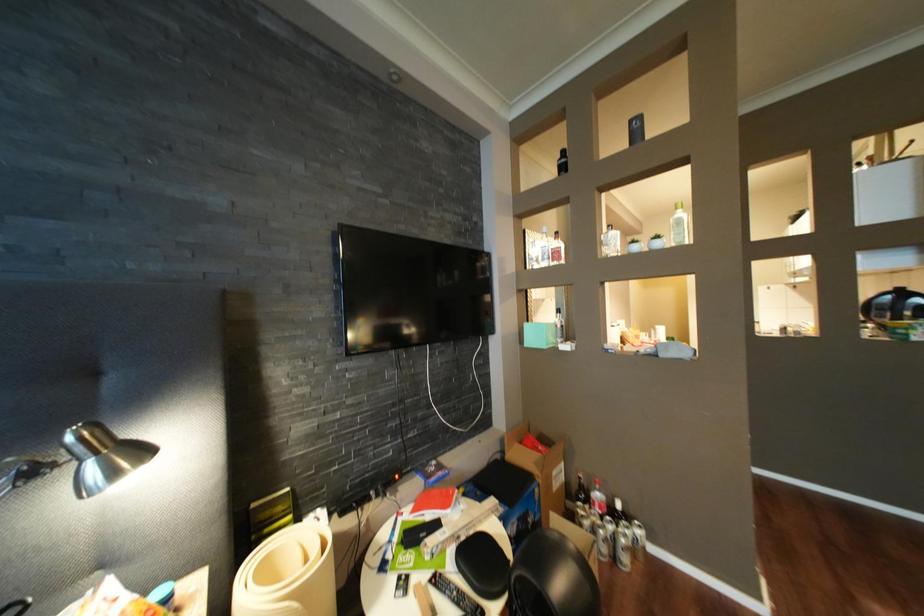
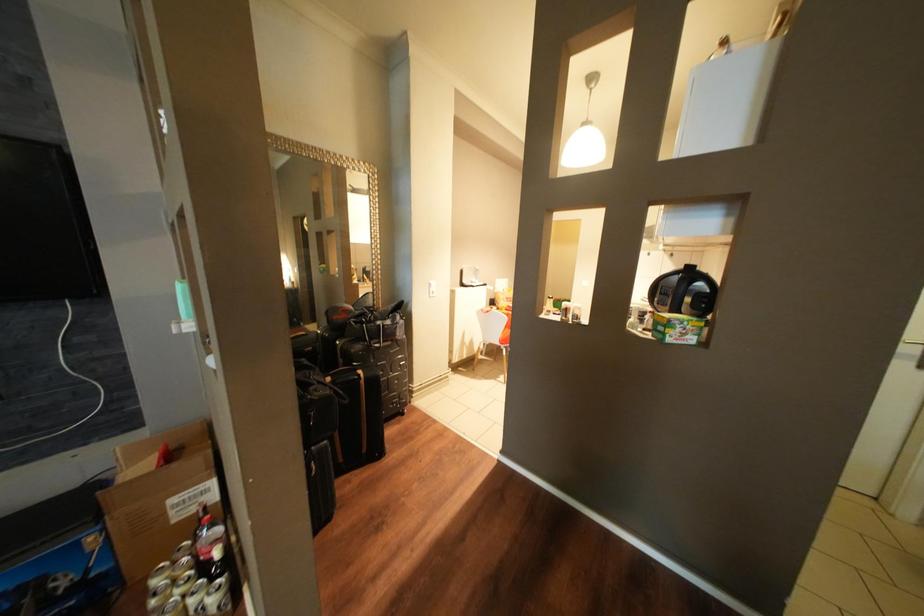
Question: What movement of the cameraman would produce the second image?

Choices:
 (A) Left
 (B) Right
 (C) Forward
 (D) Backward

Answer: (B)